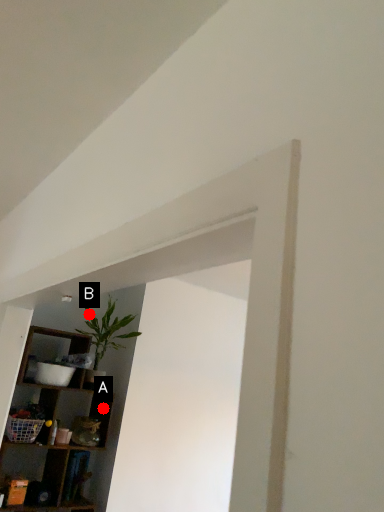
Question: Two points are circled on the image, labeled by A and B beside each circle. Which point is closer to the camera?

Choices:
 (A) A is closer
 (B) B is closer

Answer: (A)